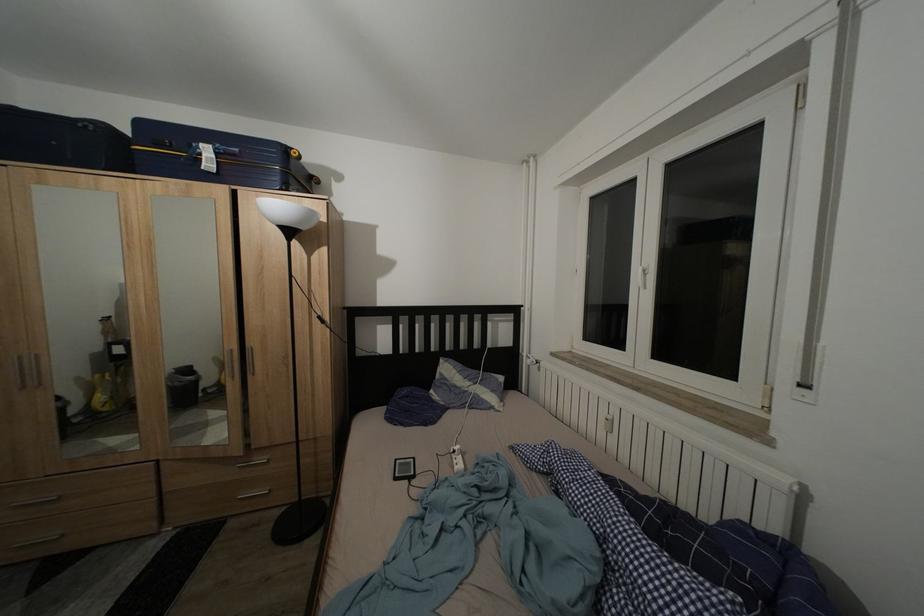
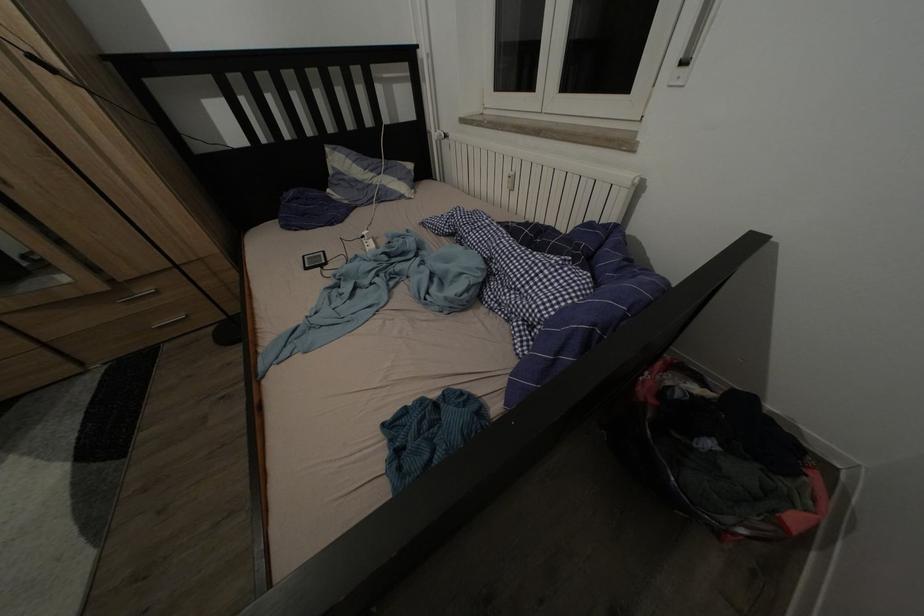
In the second image, find the point that corresponds to point (412, 458) in the first image.

(320, 254)